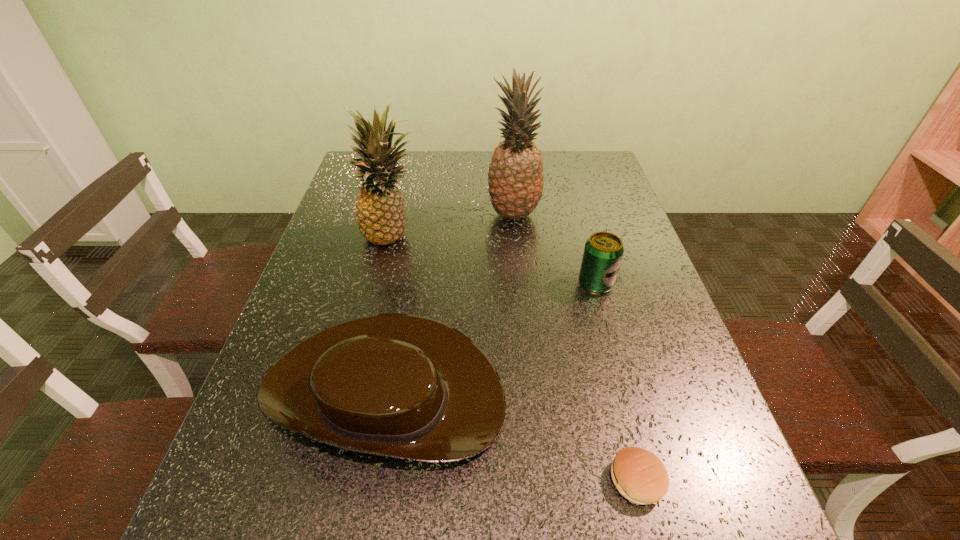
Locate an element on the screen. free region located on the left of the shortest object is located at coordinates (378, 480).

Identify the location of pineapple located at the left edge. (381, 217).

Where is `cowboy hat positioned at the left edge`? The height and width of the screenshot is (540, 960). cowboy hat positioned at the left edge is located at coordinates (404, 386).

Locate an element on the screen. The image size is (960, 540). beer can positioned at the right edge is located at coordinates (603, 252).

This screenshot has width=960, height=540. Find the location of `patty that is at the right edge`. patty that is at the right edge is located at coordinates pyautogui.click(x=640, y=476).

Find the location of a particular element. The width and height of the screenshot is (960, 540). vacant space at the far edge is located at coordinates (454, 152).

The height and width of the screenshot is (540, 960). In order to click on blank area at the near edge in this screenshot , I will do click(x=372, y=522).

This screenshot has height=540, width=960. I want to click on vacant space at the left edge, so click(x=344, y=261).

Locate an element on the screen. Image resolution: width=960 pixels, height=540 pixels. free space at the right edge is located at coordinates (622, 289).

Identify the location of blank space at the far right corner of the desktop. This screenshot has height=540, width=960. (x=588, y=185).